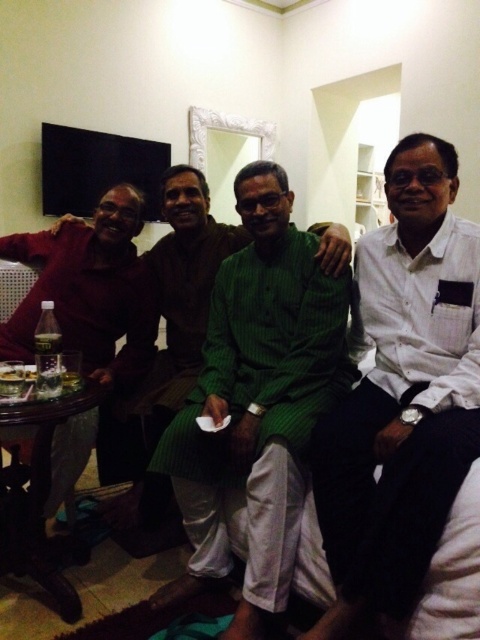
Question: Observing the image, what is the correct spatial positioning of white cotton shirt at right in reference to green textured kurta at center?

Choices:
 (A) left
 (B) right

Answer: (B)

Question: Is white cotton shirt at right closer to camera compared to green textured kurta at center?

Choices:
 (A) yes
 (B) no

Answer: (A)

Question: Which of the following is the farthest from the observer?

Choices:
 (A) (272, 556)
 (B) (437, 285)

Answer: (B)

Question: Does white cotton shirt at right lie in front of green textured kurta at center?

Choices:
 (A) yes
 (B) no

Answer: (A)

Question: Among these objects, which one is farthest from the camera?

Choices:
 (A) white cotton shirt at right
 (B) green textured kurta at center

Answer: (B)

Question: Which point is farther to the camera?

Choices:
 (A) white cotton shirt at right
 (B) green textured kurta at center

Answer: (B)